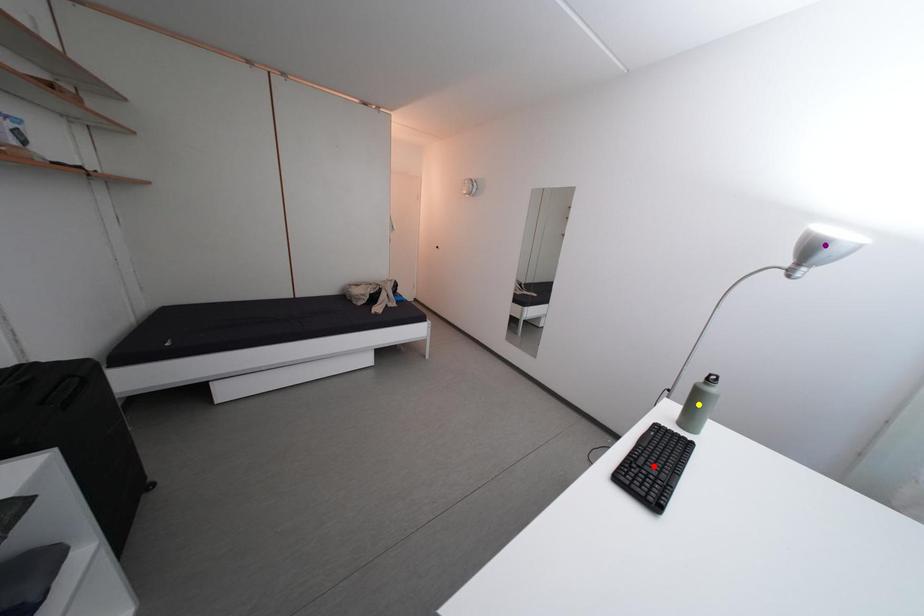
From the picture: Order these from nearest to farthest:
- yellow point
- red point
- purple point

1. red point
2. purple point
3. yellow point